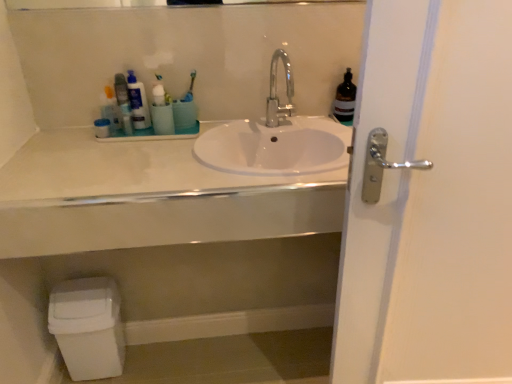
Question: Considering the relative sizes of matte plastic container at upper left, placed as the first toiletry when sorted from left to right, and polished chrome faucet at center in the image provided, is matte plastic container at upper left, placed as the first toiletry when sorted from left to right, smaller than polished chrome faucet at center?

Choices:
 (A) no
 (B) yes

Answer: (B)

Question: Is polished chrome faucet at center located within matte plastic container at upper left, placed as the 3th toiletry when sorted from right to left?

Choices:
 (A) yes
 (B) no

Answer: (B)

Question: Is matte plastic container at upper left, placed as the first toiletry when sorted from left to right, oriented towards polished chrome faucet at center?

Choices:
 (A) yes
 (B) no

Answer: (B)

Question: From the image's perspective, is matte plastic container at upper left, placed as the first toiletry when sorted from left to right, on polished chrome faucet at center?

Choices:
 (A) yes
 (B) no

Answer: (B)

Question: Is matte plastic container at upper left, placed as the first toiletry when sorted from left to right, located outside polished chrome faucet at center?

Choices:
 (A) yes
 (B) no

Answer: (A)

Question: Are matte plastic container at upper left, placed as the 3th toiletry when sorted from right to left, and polished chrome faucet at center located far from each other?

Choices:
 (A) yes
 (B) no

Answer: (B)

Question: From the image's perspective, would you say white glossy sink at center is positioned over white glossy door handle at right?

Choices:
 (A) yes
 (B) no

Answer: (A)

Question: Is white glossy sink at center located outside white glossy door handle at right?

Choices:
 (A) no
 (B) yes

Answer: (B)

Question: Considering the relative positions of white glossy sink at center and white glossy door handle at right in the image provided, is white glossy sink at center in front of white glossy door handle at right?

Choices:
 (A) no
 (B) yes

Answer: (A)

Question: From a real-world perspective, is white glossy sink at center physically above white glossy door handle at right?

Choices:
 (A) yes
 (B) no

Answer: (A)

Question: Is white glossy sink at center facing away from white glossy door handle at right?

Choices:
 (A) yes
 (B) no

Answer: (B)

Question: Is white glossy sink at center aimed at white glossy door handle at right?

Choices:
 (A) yes
 (B) no

Answer: (B)

Question: Is white glossy sink at center to the left of white plastic toilet bowl at lower left from the viewer's perspective?

Choices:
 (A) no
 (B) yes

Answer: (A)